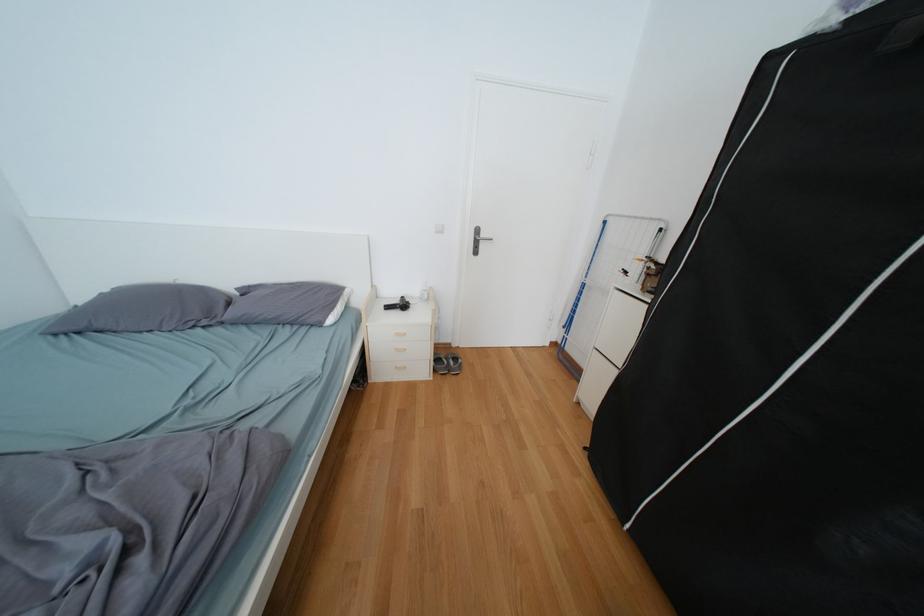
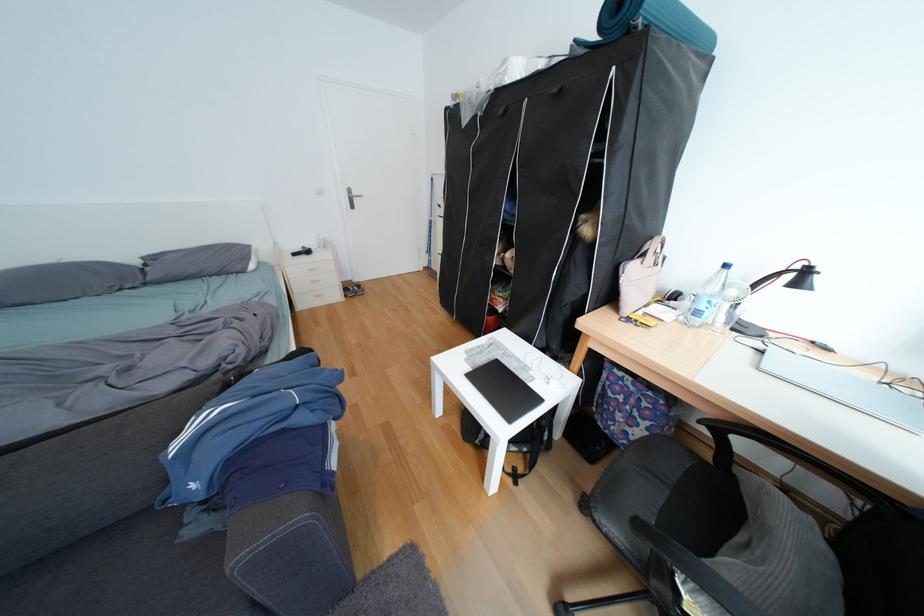
Question: Which direction would the cameraman need to move to produce the second image? Reply with the corresponding letter.

Choices:
 (A) Left
 (B) Right
 (C) Forward
 (D) Backward

Answer: (D)